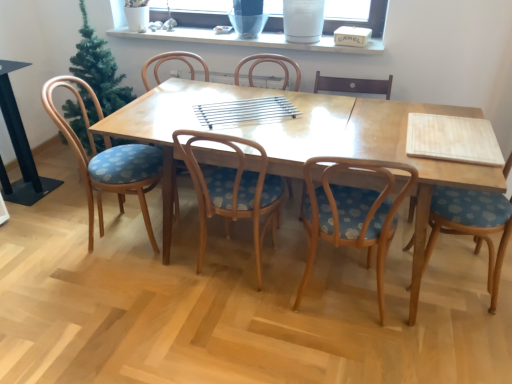
Find the location of a particular element. free point to the left of wooden chair with blue cushion at center, which is counted as the 4th chair, starting from the right is located at coordinates (170, 278).